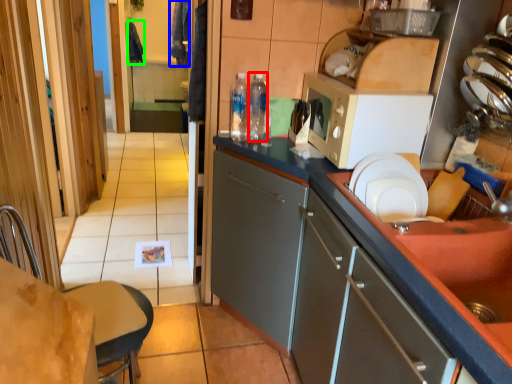
Question: Considering the real-world distances, which object is farthest from bottle (highlighted by a red box)? laundry (highlighted by a blue box) or laundry (highlighted by a green box)?

Choices:
 (A) laundry
 (B) laundry

Answer: (B)